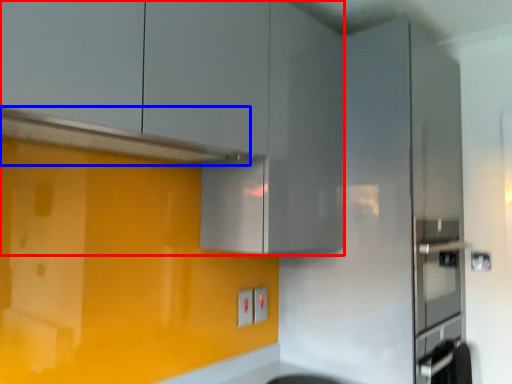
Question: Which object appears farthest to the camera in this image, cabinetry (highlighted by a red box) or exhaust hood (highlighted by a blue box)?

Choices:
 (A) cabinetry
 (B) exhaust hood

Answer: (B)